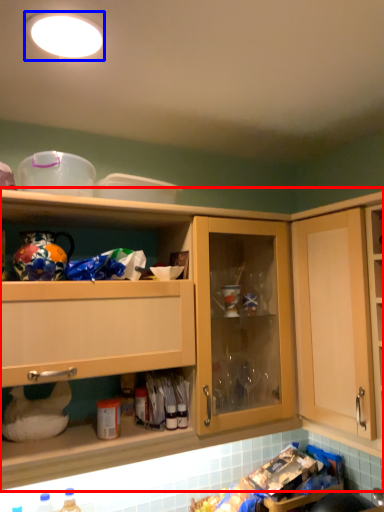
Question: Which object is further to the camera taking this photo, cabinetry (highlighted by a red box) or lighting (highlighted by a blue box)?

Choices:
 (A) cabinetry
 (B) lighting

Answer: (A)